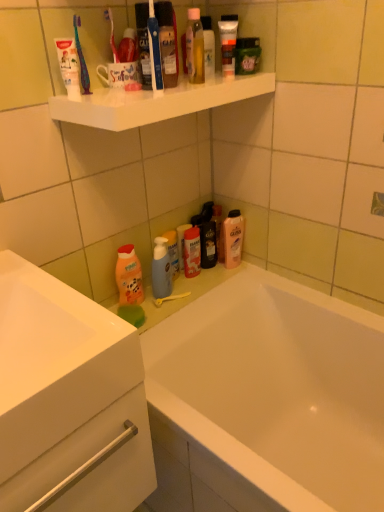
I want to click on vacant area that lies to the right of orange matte bottle at lower left, so click(x=179, y=296).